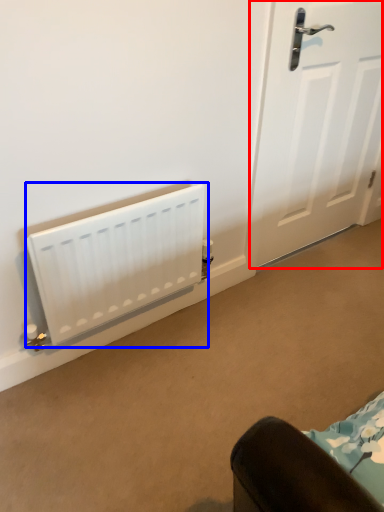
Question: Which point is closer to the camera, door (highlighted by a red box) or radiator (highlighted by a blue box)?

Choices:
 (A) door
 (B) radiator

Answer: (B)